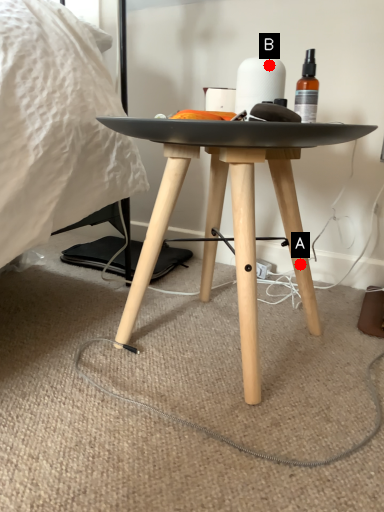
Question: Two points are circled on the image, labeled by A and B beside each circle. Which point is closer to the camera?

Choices:
 (A) A is closer
 (B) B is closer

Answer: (B)